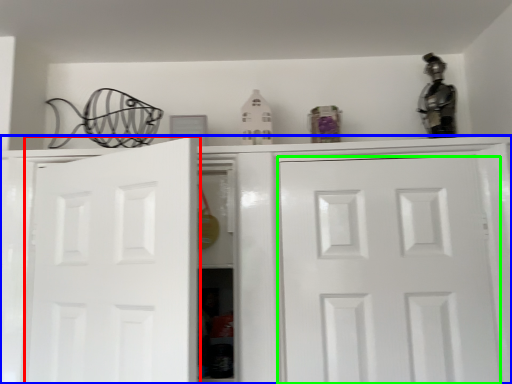
Question: Which object is positioned farthest from door (highlighted by a red box)? Select from cabinetry (highlighted by a blue box) and door (highlighted by a green box).

Choices:
 (A) cabinetry
 (B) door

Answer: (B)